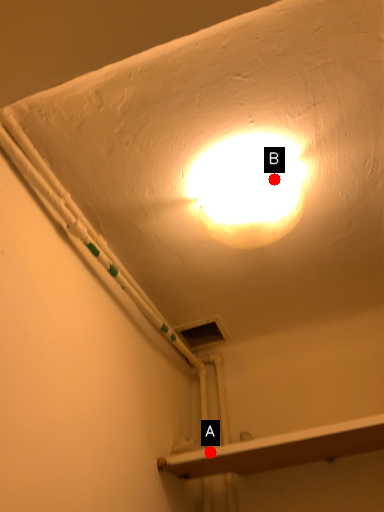
Question: Two points are circled on the image, labeled by A and B beside each circle. Which point is closer to the camera?

Choices:
 (A) A is closer
 (B) B is closer

Answer: (B)